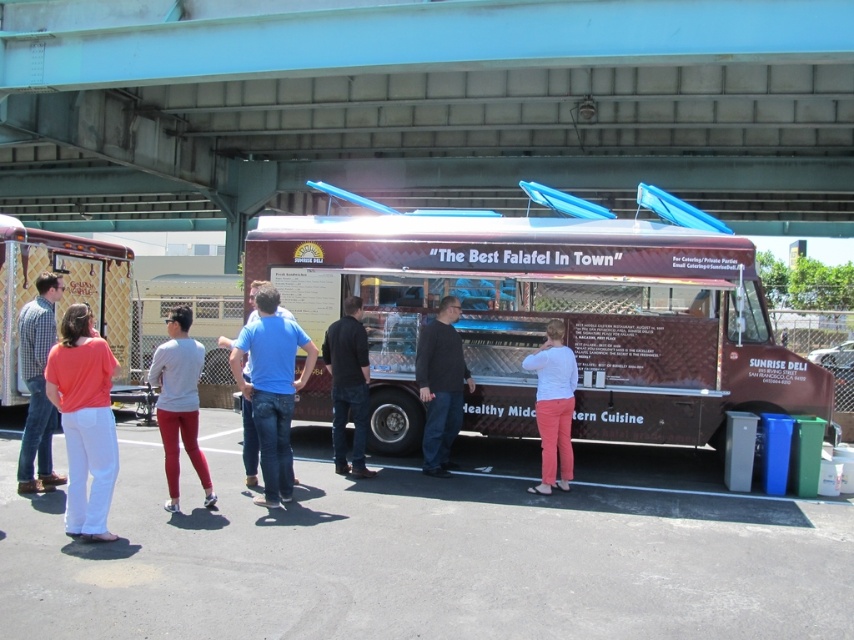
Question: Based on their relative distances, which object is farther from the brown textured food truck at center?

Choices:
 (A) matte coral blouse at left
 (B) white matte shirt at center
 (C) gray asphalt at lower center
 (D) blue denim jeans at center

Answer: (C)

Question: Does blue denim jeans at center lie behind dark brown leather jacket at center?

Choices:
 (A) yes
 (B) no

Answer: (B)

Question: Which point is closer to the camera taking this photo?

Choices:
 (A) (42, 406)
 (B) (268, 435)

Answer: (B)

Question: Which of the following is the farthest from the observer?

Choices:
 (A) black cotton shirt at center
 (B) matte plaid shirt at lower left
 (C) white matte shirt at center
 (D) smooth concrete bridge at upper center

Answer: (D)

Question: Can you confirm if smooth concrete bridge at upper center is bigger than black cotton shirt at center?

Choices:
 (A) yes
 (B) no

Answer: (A)

Question: Where is smooth concrete bridge at upper center located in relation to gray asphalt at lower center in the image?

Choices:
 (A) above
 (B) below

Answer: (A)